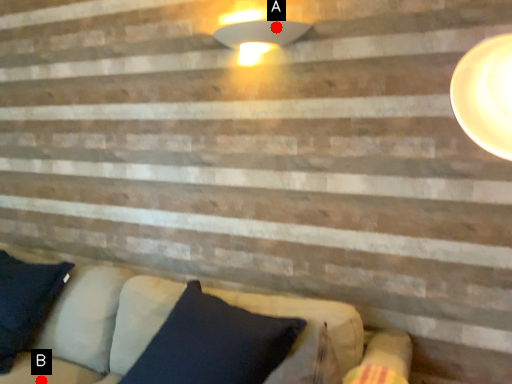
Question: Two points are circled on the image, labeled by A and B beside each circle. Which point is closer to the camera taking this photo?

Choices:
 (A) A is closer
 (B) B is closer

Answer: (B)